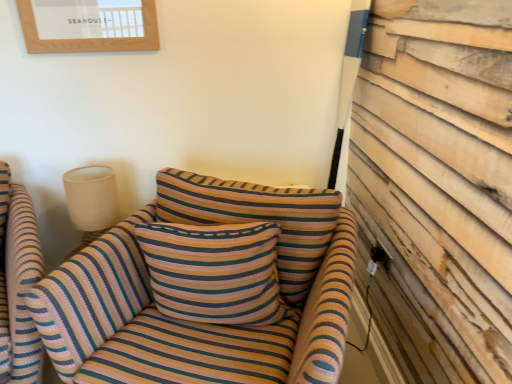
In order to face wooden framed picture at upper left, should I rotate leftwards or rightwards?

You should look left and rotate roughly 21.256 degrees.

What do you see at coordinates (88, 39) in the screenshot? I see `wooden framed picture at upper left` at bounding box center [88, 39].

In order to face beige fabric lampshade at upper left, should I rotate leftwards or rightwards?

Turn left by 20.593 degrees to look at beige fabric lampshade at upper left.

The height and width of the screenshot is (384, 512). In order to click on striped fabric pillow at center in this screenshot , I will do `click(214, 272)`.

Describe the element at coordinates (214, 272) in the screenshot. I see `striped fabric pillow at center` at that location.

Find the location of a particular element. The height and width of the screenshot is (384, 512). wooden framed picture at upper left is located at coordinates (88, 39).

Is wooden framed picture at upper left oriented towards striped fabric pillow at center?

No, wooden framed picture at upper left is not turned towards striped fabric pillow at center.

Is wooden framed picture at upper left wider than striped fabric pillow at center?

No, wooden framed picture at upper left is not wider than striped fabric pillow at center.

Is point (122, 43) farther from viewer compared to point (153, 238)?

Yes, it is behind point (153, 238).

Between wooden framed picture at upper left and striped fabric pillow at center, which one is positioned in front?

striped fabric pillow at center is in front.

I want to click on lamp on the left of the striped fabric couch at center, so pos(91,200).

Is beige fabric lampshade at upper left at the left side of striped fabric couch at center?

Correct, you'll find beige fabric lampshade at upper left to the left of striped fabric couch at center.

Considering the relative sizes of beige fabric lampshade at upper left and striped fabric couch at center in the image provided, is beige fabric lampshade at upper left thinner than striped fabric couch at center?

Yes, beige fabric lampshade at upper left is thinner than striped fabric couch at center.

Which is nearer, [83,167] or [170,274]?

Point [83,167] is farther from the camera than point [170,274].

Is striped fabric couch at center facing away from beige fabric lampshade at upper left?

That's not correct — striped fabric couch at center is not looking away from beige fabric lampshade at upper left.

Which object is more forward, striped fabric couch at center or beige fabric lampshade at upper left?

striped fabric couch at center.

Which is more to the right, striped fabric couch at center or beige fabric lampshade at upper left?

striped fabric couch at center.

Based on the photo, how distant is striped fabric couch at center from beige fabric lampshade at upper left?

striped fabric couch at center and beige fabric lampshade at upper left are 20.05 inches apart.

Which is behind, point (271, 309) or point (25, 39)?

Point (25, 39)

How distant is striped fabric pillow at center from wooden framed picture at upper left?

The distance of striped fabric pillow at center from wooden framed picture at upper left is 36.87 inches.

Identify the location of picture frame that appears above the striped fabric pillow at center (from a real-world perspective). The width and height of the screenshot is (512, 384). (88, 39).

In the scene shown: Is striped fabric pillow at center not within wooden framed picture at upper left?

Indeed, striped fabric pillow at center is completely outside wooden framed picture at upper left.

Choose the correct answer: Is beige fabric lampshade at upper left inside striped fabric chair at left or outside it?

The correct answer is: outside.

From a real-world perspective, is beige fabric lampshade at upper left physically below striped fabric chair at left?

No, from a real-world perspective, beige fabric lampshade at upper left is not under striped fabric chair at left.

In terms of size, does beige fabric lampshade at upper left appear bigger or smaller than striped fabric chair at left?

Clearly, beige fabric lampshade at upper left is smaller in size than striped fabric chair at left.

The height and width of the screenshot is (384, 512). Find the location of `chair on the left of beige fabric lampshade at upper left`. chair on the left of beige fabric lampshade at upper left is located at coordinates (18, 283).

Can you confirm if striped fabric chair at left is bigger than striped fabric couch at center?

No, striped fabric chair at left is not bigger than striped fabric couch at center.

Considering the positions of objects striped fabric chair at left and striped fabric couch at center in the image provided, who is more to the left, striped fabric chair at left or striped fabric couch at center?

From the viewer's perspective, striped fabric chair at left appears more on the left side.

From a real-world perspective, is striped fabric chair at left physically above striped fabric couch at center?

No, from a real-world perspective, striped fabric chair at left is not on top of striped fabric couch at center.

Is striped fabric chair at left inside or outside of striped fabric couch at center?

striped fabric chair at left is not inside striped fabric couch at center, it's outside.

At what (x,y) coordinates should I click in order to perform the action: click on chair above the striped fabric couch at center (from the image's perspective). Please return your answer as a coordinate pair (x, y). This screenshot has height=384, width=512. Looking at the image, I should click on (18, 283).

Is striped fabric couch at center facing towards striped fabric chair at left?

No, striped fabric couch at center is not aimed at striped fabric chair at left.

Considering the relative positions of striped fabric couch at center and striped fabric chair at left in the image provided, is striped fabric couch at center in front of striped fabric chair at left?

Yes, striped fabric couch at center is closer to the camera.

From a real-world perspective, is striped fabric couch at center above or below striped fabric chair at left?

Clearly, from a real-world perspective, striped fabric couch at center is above striped fabric chair at left.

At what (x,y) coordinates should I click in order to perform the action: click on picture frame behind the striped fabric pillow at center. Please return your answer as a coordinate pair (x, y). Looking at the image, I should click on (88, 39).

Find the location of a particular element. Image resolution: width=512 pixels, height=384 pixels. lamp to the left of striped fabric couch at center is located at coordinates (91, 200).

Which object lies nearer to the anchor point beige fabric lampshade at upper left, wooden framed picture at upper left or striped fabric chair at left?

striped fabric chair at left lies closer to beige fabric lampshade at upper left than the other object.

Looking at the image, which one is located further to beige fabric lampshade at upper left, wooden framed picture at upper left or striped fabric pillow at center?

wooden framed picture at upper left is positioned further to the anchor beige fabric lampshade at upper left.

From the image, which object appears to be nearer to striped fabric couch at center, beige fabric lampshade at upper left or striped fabric chair at left?

striped fabric chair at left lies closer to striped fabric couch at center than the other object.

Based on their spatial positions, is striped fabric pillow at center or striped fabric couch at center further from wooden framed picture at upper left?

The object further to wooden framed picture at upper left is striped fabric couch at center.

Which object lies further to the anchor point beige fabric lampshade at upper left, striped fabric couch at center or striped fabric pillow at center?

Based on the image, striped fabric pillow at center appears to be further to beige fabric lampshade at upper left.

Estimate the real-world distances between objects in this image. Which object is further from wooden framed picture at upper left, beige fabric lampshade at upper left or striped fabric couch at center?

striped fabric couch at center is positioned further to the anchor wooden framed picture at upper left.

Which object lies further to the anchor point striped fabric chair at left, wooden framed picture at upper left or striped fabric couch at center?

wooden framed picture at upper left is positioned further to the anchor striped fabric chair at left.

Looking at the image, which one is located further to striped fabric chair at left, striped fabric couch at center or wooden framed picture at upper left?

Among the two, wooden framed picture at upper left is located further to striped fabric chair at left.

You are a GUI agent. You are given a task and a screenshot of the screen. Output one action in this format:
    pyautogui.click(x=<x>, y=<y>)
    Task: Click on the lamp between striped fabric chair at left and striped fabric pillow at center
    The width and height of the screenshot is (512, 384).
    Given the screenshot: What is the action you would take?
    pyautogui.click(x=91, y=200)

Identify the location of pillow between wooden framed picture at upper left and striped fabric chair at left in the vertical direction. (214, 272).

You are a GUI agent. You are given a task and a screenshot of the screen. Output one action in this format:
    pyautogui.click(x=<x>, y=<y>)
    Task: Click on the chair between wooden framed picture at upper left and striped fabric couch at center from top to bottom
    The height and width of the screenshot is (384, 512).
    Given the screenshot: What is the action you would take?
    pyautogui.click(x=18, y=283)

Where is `pillow located between striped fabric chair at left and striped fabric couch at center in the left-right direction`? The width and height of the screenshot is (512, 384). pillow located between striped fabric chair at left and striped fabric couch at center in the left-right direction is located at coordinates (214, 272).